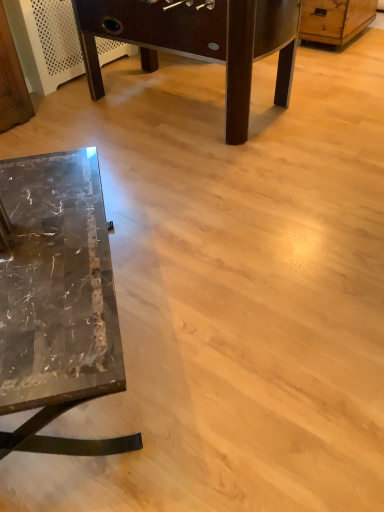
Locate an element on the screen. vacant space to the right of marble table at lower left, which is the 2th table in top-to-bottom order is located at coordinates (235, 318).